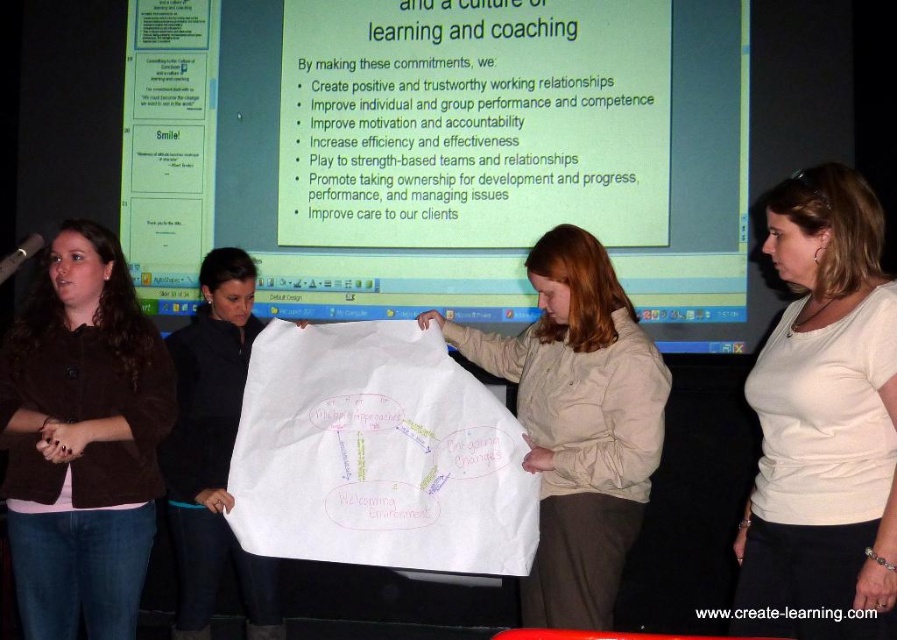
You are standing in front of the group and looking at the diagram they are holding. Which of the two points, point [841,483] or point [573,260], is closer to you?

Point [841,483] is in front of point [573,260], so it is closer to you.

You are organizing a presentation and need to ensure that all visual aids are clearly visible to the audience. Given the scene described, which object between the brown fabric jacket at left and the beige fabric paper at center is larger and thus more suitable for displaying important information?

The beige fabric paper at center is larger than the brown fabric jacket at left, making it more suitable for displaying important information as it occupies more space and is positioned at the center for better visibility.